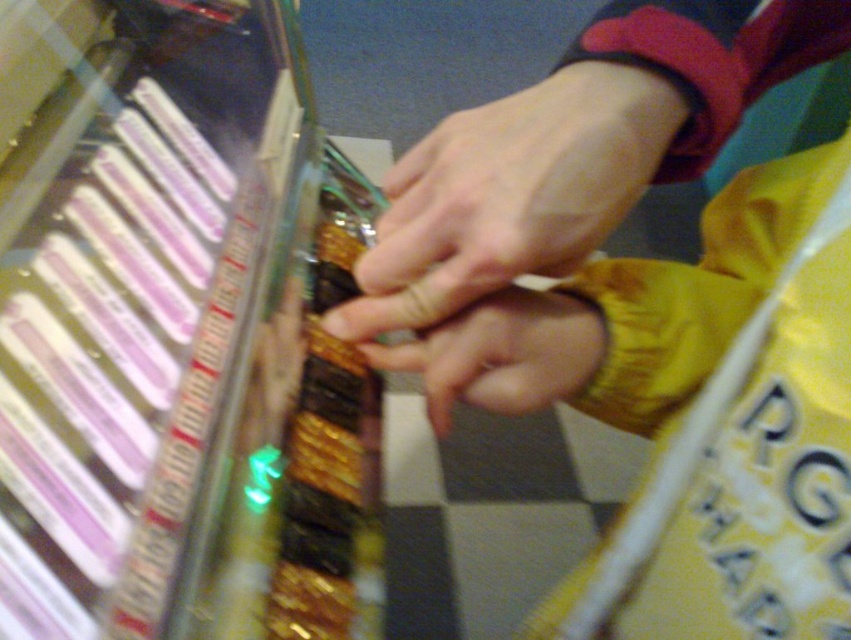
You are a delivery robot with a height of 12 inches. You need to deliver a package to the yellow fabric at center. Can you reach it without bending down?

The yellow fabric at center is 11.10 inches away from the viewer. Since the robot is 12 inches tall, it can reach the yellow fabric at center without bending down as it is slightly taller than the distance required.

You are a cashier at a store and see a customer reaching for an item in the display case. The customer has a yellow fabric at center and a smooth skin hand at center. Which object is located lower in the scene?

The yellow fabric at center is located lower than the smooth skin hand at center in the scene.